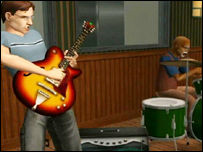
You are a GUI agent. You are given a task and a screenshot of the screen. Output one action in this format:
    pyautogui.click(x=<x>, y=<y>)
    Task: Click on the window
    The image size is (203, 152).
    Given the screenshot: What is the action you would take?
    pyautogui.click(x=145, y=31)